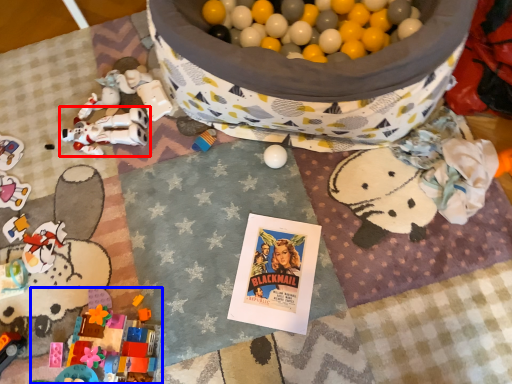
Question: Which point is further to the camera, toy (highlighted by a red box) or toy (highlighted by a blue box)?

Choices:
 (A) toy
 (B) toy

Answer: (A)